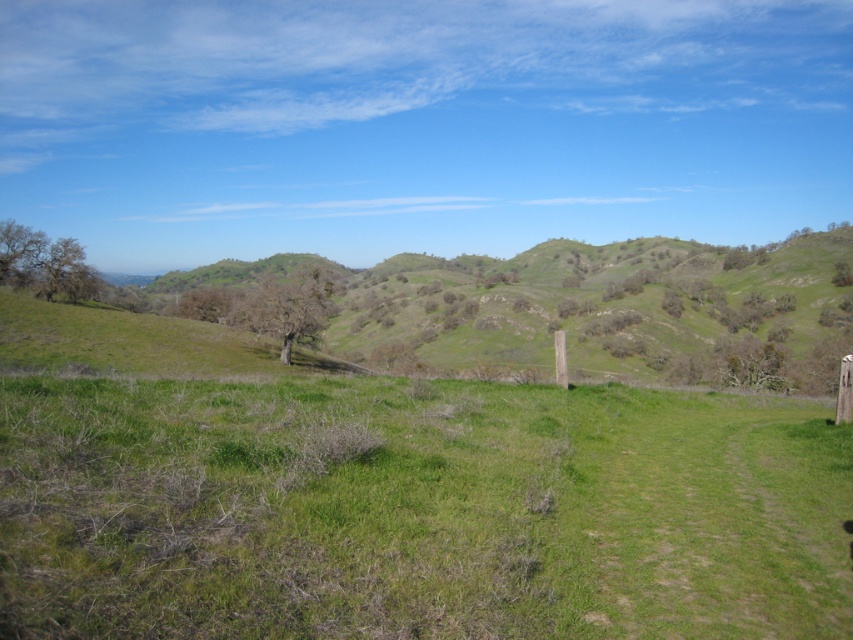
This screenshot has height=640, width=853. I want to click on green grassy field at center, so point(416,512).

Is point (393, 492) closer to camera compared to point (834, 416)?

Yes, point (393, 492) is in front of point (834, 416).

Between point (402, 465) and point (839, 403), which one is positioned behind?

Point (839, 403)

The height and width of the screenshot is (640, 853). I want to click on green grassy field at center, so click(416, 512).